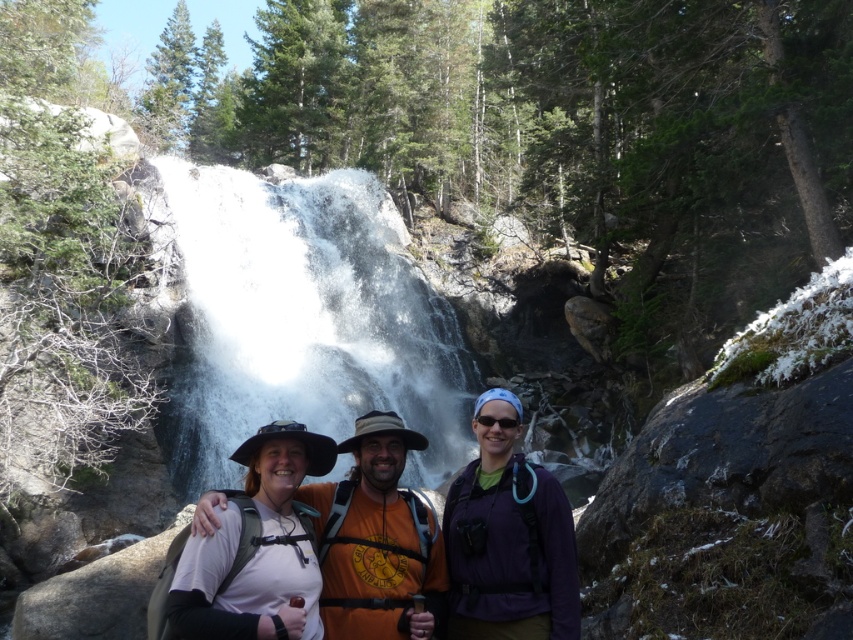
Question: Which is nearer to the purple fabric backpack at center?

Choices:
 (A) white matte hat at center
 (B) white frothy water at center

Answer: (A)

Question: Which is nearer to the white fabric shirt at center?

Choices:
 (A) purple fabric backpack at center
 (B) white frothy water at center

Answer: (A)

Question: From the image, what is the correct spatial relationship of white frothy water at center in relation to white fabric shirt at center?

Choices:
 (A) above
 (B) below

Answer: (A)

Question: Is white frothy water at center thinner than purple fabric backpack at center?

Choices:
 (A) no
 (B) yes

Answer: (A)

Question: Can you confirm if purple fabric backpack at center is positioned to the right of white matte hat at center?

Choices:
 (A) no
 (B) yes

Answer: (B)

Question: Which is nearer to the white matte hat at center?

Choices:
 (A) white frothy water at center
 (B) white fabric shirt at center
 (C) purple fabric backpack at center

Answer: (B)